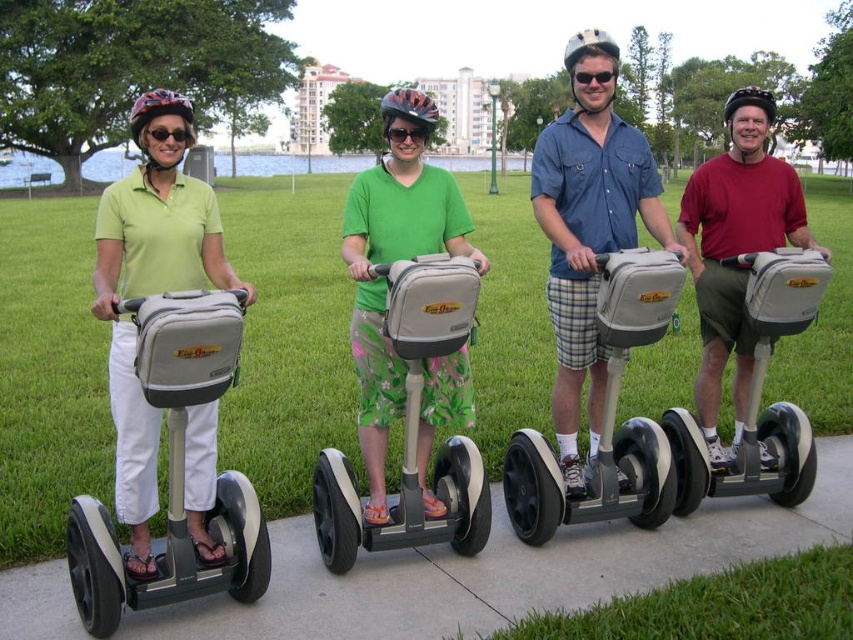
Question: Which object appears farthest from the camera in this image?

Choices:
 (A) green matte shirt at center
 (B) matte black goggles at upper left

Answer: (A)

Question: Does gray matte segway at center appear on the left side of black matte sunglasses at center?

Choices:
 (A) no
 (B) yes

Answer: (A)

Question: Estimate the real-world distances between objects in this image. Which object is farther from the black plastic sunglasses at center?

Choices:
 (A) black matte sunglasses at center
 (B) matte green shirt at center
 (C) gray concrete pavement at center

Answer: (C)

Question: Can you confirm if matte black goggles at upper left is positioned above black plastic sunglasses at center?

Choices:
 (A) yes
 (B) no

Answer: (B)

Question: From the image, what is the correct spatial relationship of gray concrete pavement at center in relation to matte gray scooter at right?

Choices:
 (A) right
 (B) left

Answer: (B)

Question: Which point is farther to the camera?

Choices:
 (A) black matte sunglasses at center
 (B) black plastic sunglasses at center
 (C) matte gray scooter at center

Answer: (B)